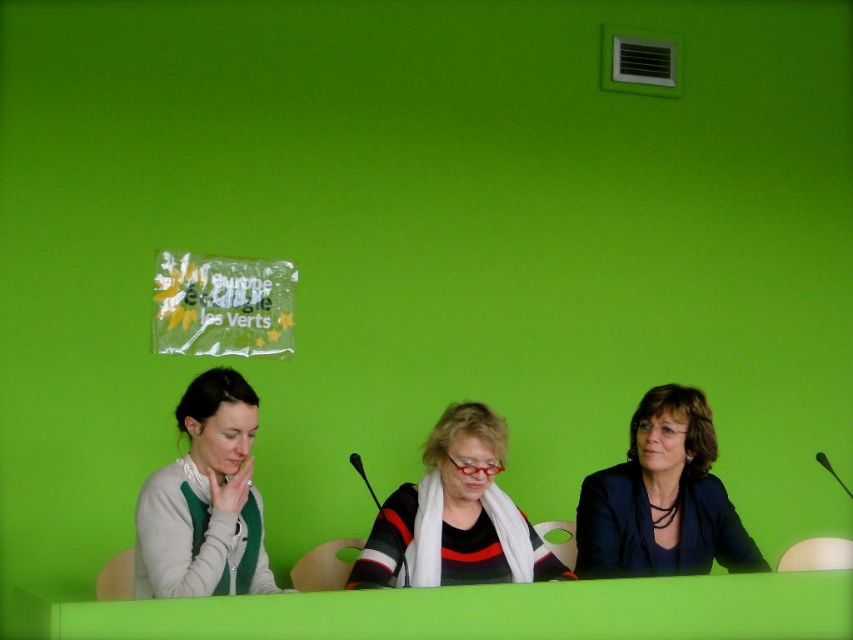
You are a delivery person holding a large package that requires a 1.5 meter clearance to maneuver. You are standing in front of the green matte table at center. Can you safely move the package past the table without hitting anything?

The distance between you and the green matte table at center is 1.68 meters, which is greater than the required 1.5 meter clearance. Therefore, you can safely move the package past the green matte table at center without any issues.